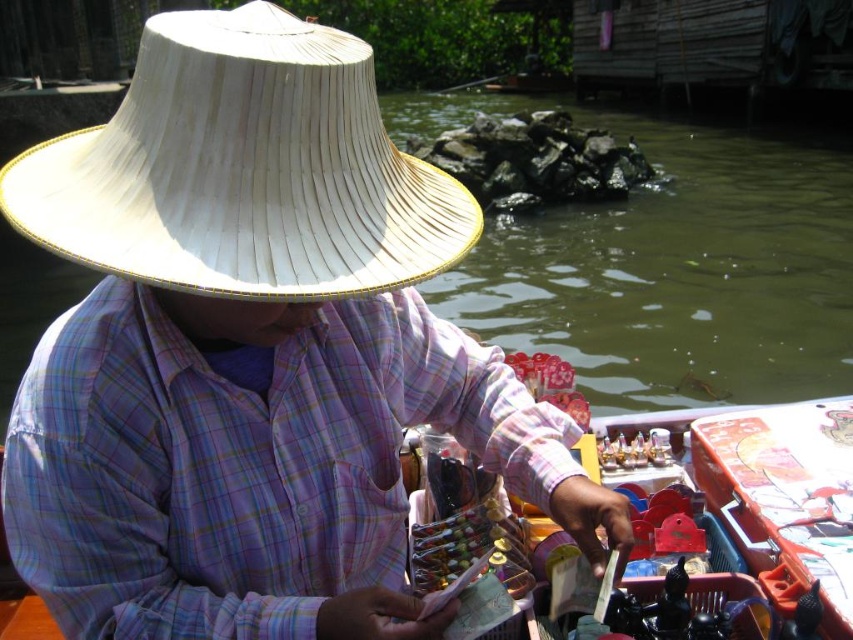
Question: Which point appears farthest from the camera in this image?

Choices:
 (A) (109, 376)
 (B) (164, 177)

Answer: (A)

Question: Which point is closer to the camera?

Choices:
 (A) click(308, 486)
 (B) click(260, 99)

Answer: (B)

Question: Does plaid fabric at center have a larger size compared to white woven straw hat at upper center?

Choices:
 (A) yes
 (B) no

Answer: (A)

Question: Does plaid fabric at center have a larger size compared to white woven straw hat at upper center?

Choices:
 (A) no
 (B) yes

Answer: (B)

Question: Which point is farther from the camera taking this photo?

Choices:
 (A) (184, 272)
 (B) (361, 369)

Answer: (B)

Question: Is the position of plaid fabric at center more distant than that of white woven straw hat at upper center?

Choices:
 (A) no
 (B) yes

Answer: (B)